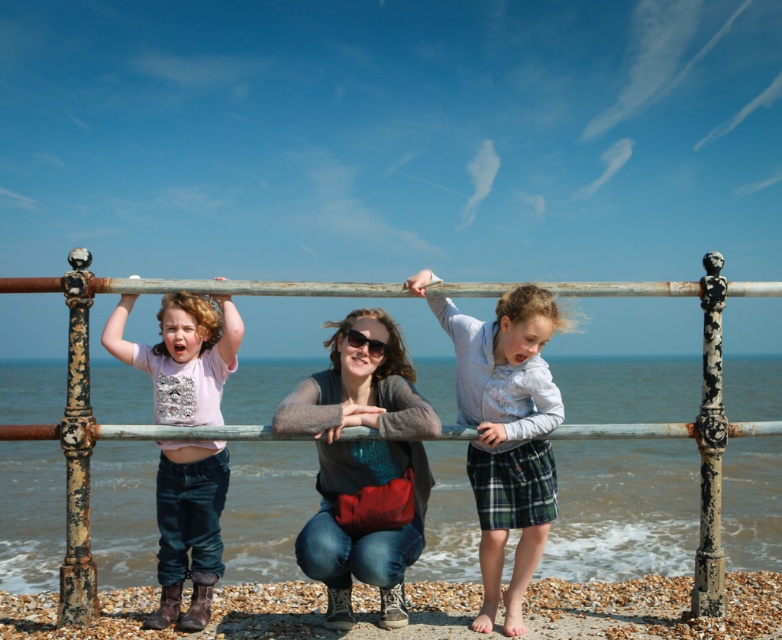
You are a photographer trying to capture a clear shot of both the rusty metal pole at left and the matte black sunglasses at center. Since you want both objects in focus, which one should you adjust your camera focus on first to ensure both are sharp?

You should focus on the rusty metal pole at left first because it is closer to the viewer than the matte black sunglasses at center. By focusing on the closer object, the farther one will also be in focus due to the depth of field.

You are standing in front of the seaside railing and want to place a small flag at the point closer to you between point (712, 600) and point (354, 332). Which point should you choose?

You should choose point (712, 600) because it is closer to the camera than point (354, 332).